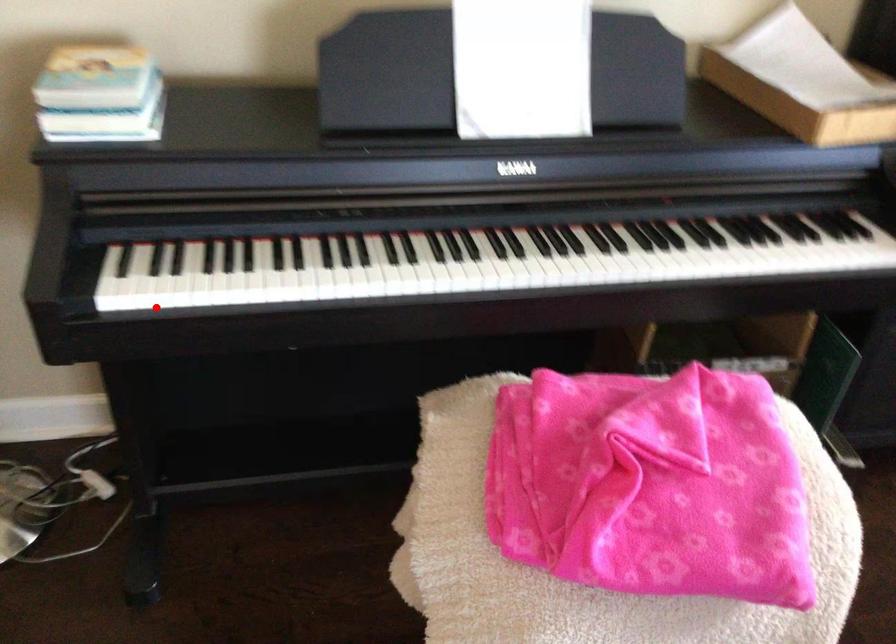
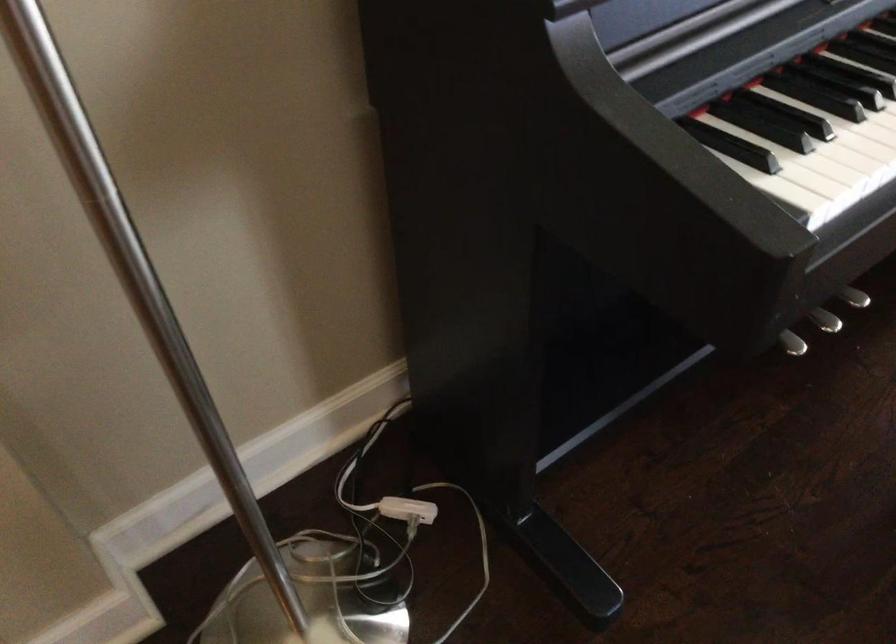
Question: I am providing you with two images of the same scene from different viewpoints. A red point is marked on the first image. Is the red point's position out of view in image 2?

Choices:
 (A) Yes
 (B) No

Answer: (B)